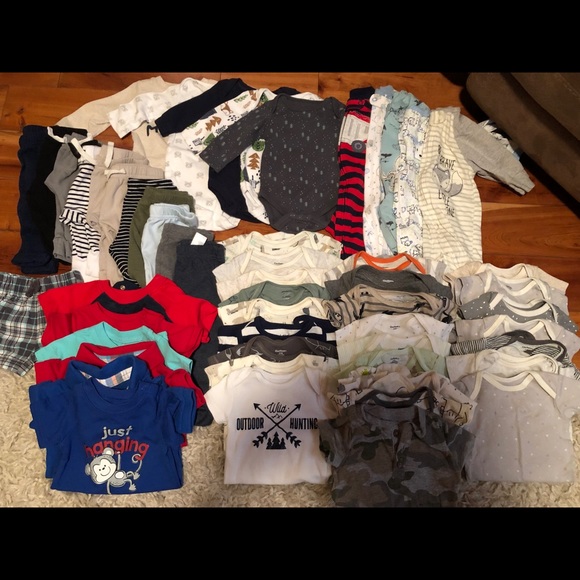
Where is `folded children's pajamas`? folded children's pajamas is located at coordinates (353, 135), (374, 135), (392, 139), (407, 136), (449, 148).